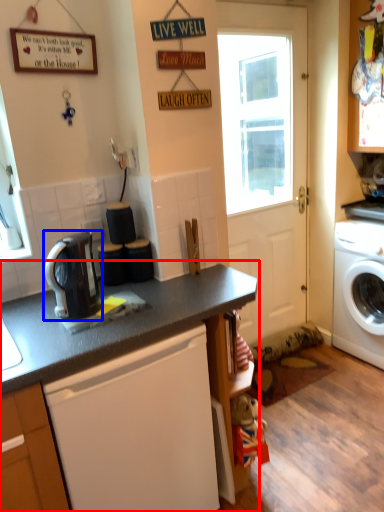
Question: Which object appears farthest to the camera in this image, countertop (highlighted by a red box) or kitchen appliance (highlighted by a blue box)?

Choices:
 (A) countertop
 (B) kitchen appliance

Answer: (B)